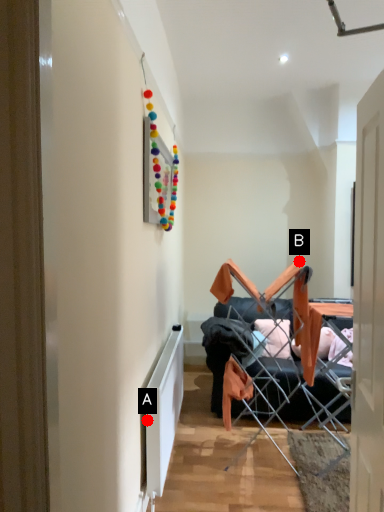
Question: Two points are circled on the image, labeled by A and B beside each circle. Which point is closer to the camera?

Choices:
 (A) A is closer
 (B) B is closer

Answer: (A)